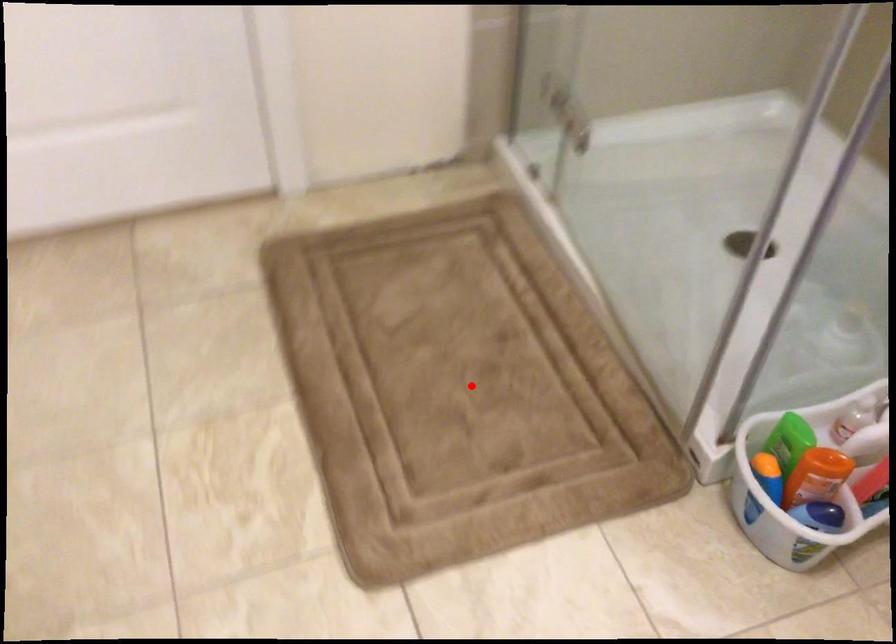
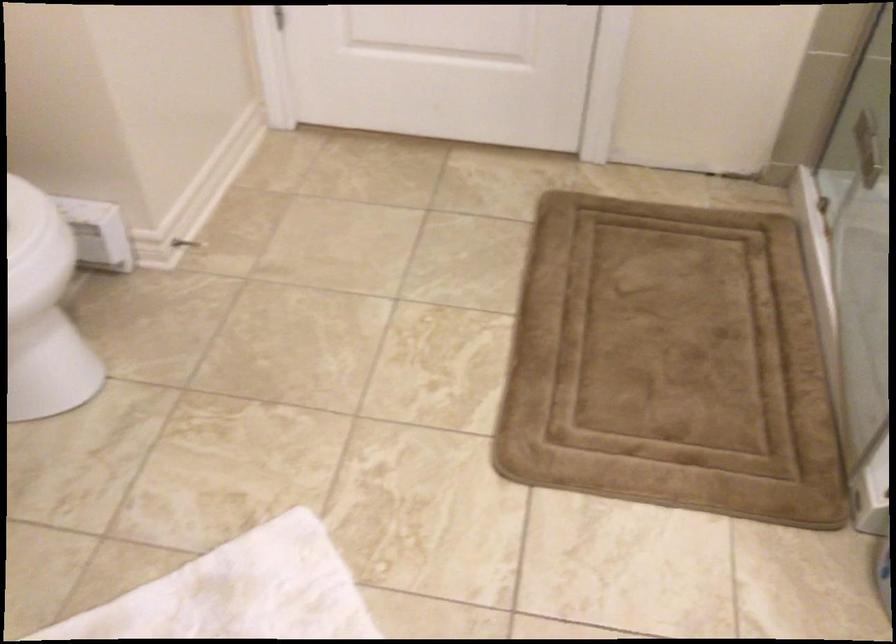
The point at the highlighted location is marked in the first image. Where is the corresponding point in the second image?

(670, 363)